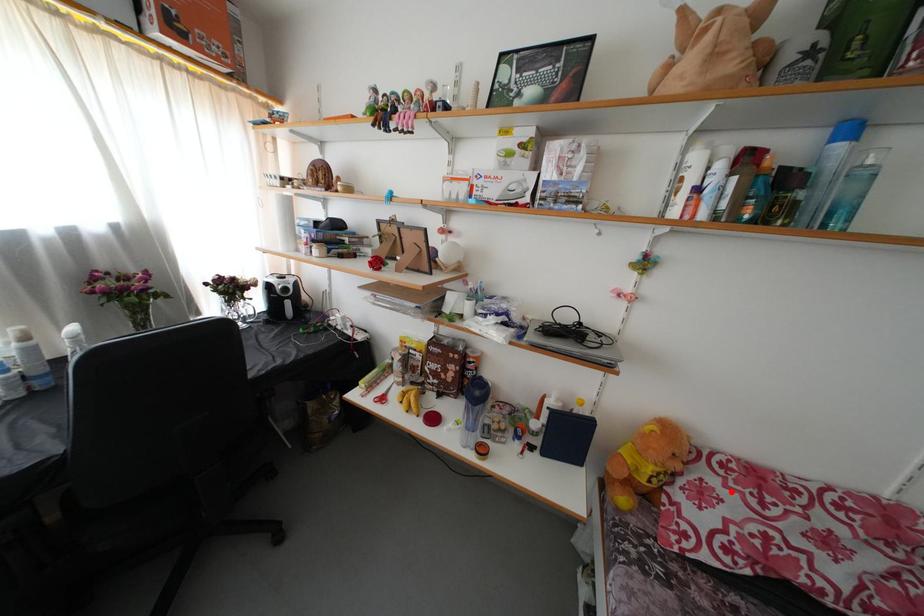
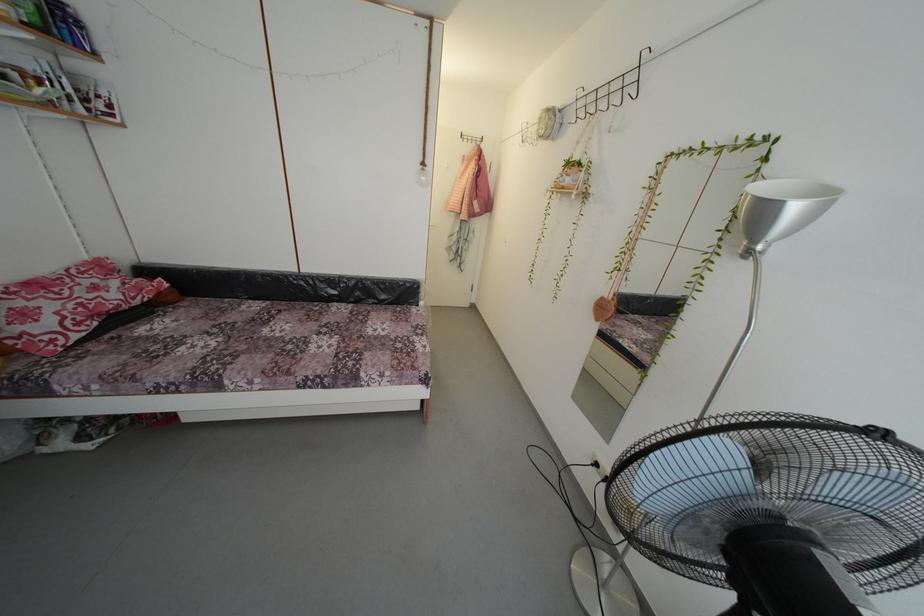
Question: A red point is marked in image1. In image2, is the corresponding 3D point closer to the camera or farther? Reply with the corresponding letter.

Choices:
 (A) The corresponding 3D point is closer.
 (B) The corresponding 3D point is farther.

Answer: (B)